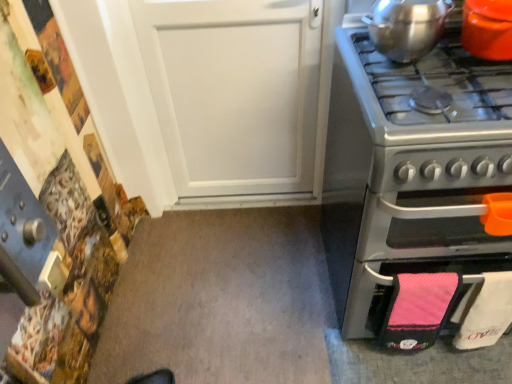
This screenshot has width=512, height=384. Find the location of `free space that is to the left of orange glossy pot at upper right, positioned as the 1th kitchen appliance in right-to-left order`. free space that is to the left of orange glossy pot at upper right, positioned as the 1th kitchen appliance in right-to-left order is located at coordinates (440, 69).